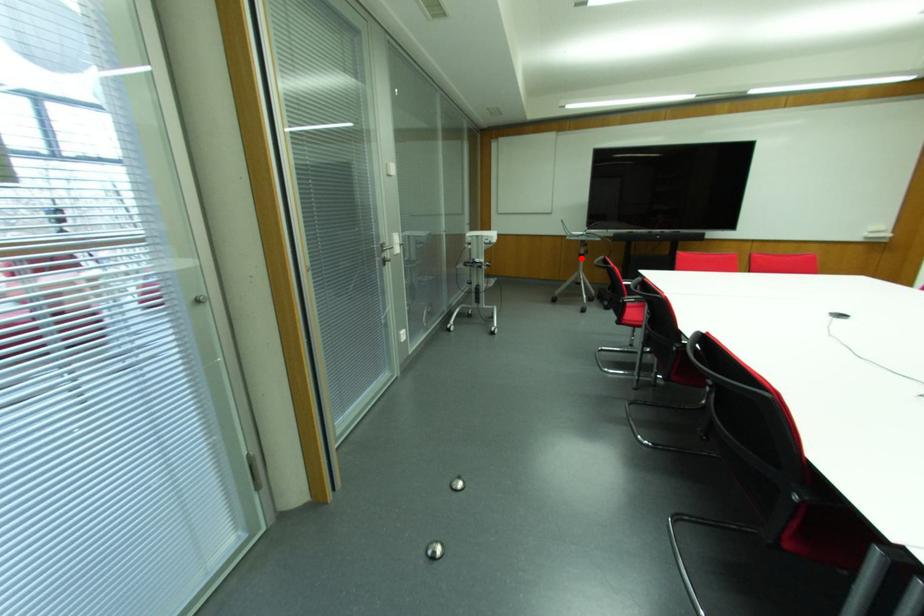
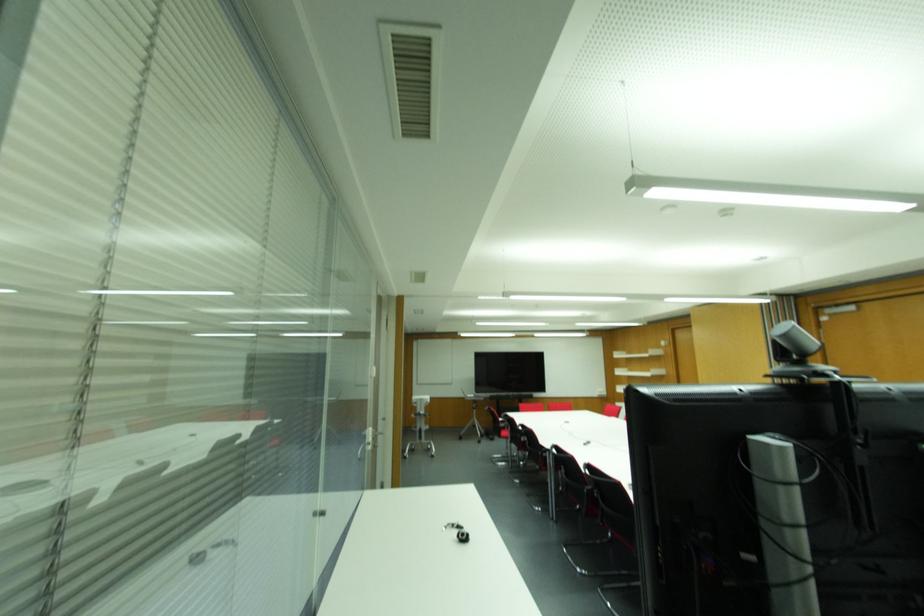
Question: I am providing you with two images of the same scene from different viewpoints. Image1 has a red point marked. In image2, the corresponding 3D location appears at what relative position? Reply with the corresponding letter.

Choices:
 (A) Closer
 (B) Farther

Answer: (B)